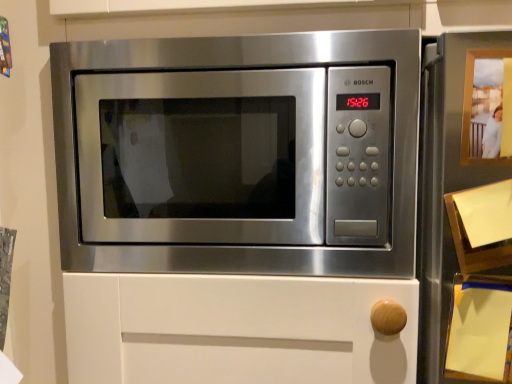
Question: Should I look upward or downward to see matte wood photo frame at upper right?

Choices:
 (A) up
 (B) down

Answer: (A)

Question: Considering the relative sizes of matte wood photo frame at upper right and stainless steel microwave at center in the image provided, is matte wood photo frame at upper right taller than stainless steel microwave at center?

Choices:
 (A) no
 (B) yes

Answer: (A)

Question: From a real-world perspective, is matte wood photo frame at upper right below stainless steel microwave at center?

Choices:
 (A) yes
 (B) no

Answer: (B)

Question: Is matte wood photo frame at upper right far from stainless steel microwave at center?

Choices:
 (A) no
 (B) yes

Answer: (A)

Question: Considering the relative sizes of matte wood photo frame at upper right and stainless steel microwave at center in the image provided, is matte wood photo frame at upper right smaller than stainless steel microwave at center?

Choices:
 (A) yes
 (B) no

Answer: (A)

Question: Is matte wood photo frame at upper right turned away from stainless steel microwave at center?

Choices:
 (A) yes
 (B) no

Answer: (B)

Question: Considering the relative positions of matte wood photo frame at upper right and stainless steel microwave at center in the image provided, is matte wood photo frame at upper right behind stainless steel microwave at center?

Choices:
 (A) yes
 (B) no

Answer: (B)

Question: From a real-world perspective, is stainless steel microwave at center physically below matte wood photo frame at upper right?

Choices:
 (A) no
 (B) yes

Answer: (B)

Question: Considering the relative sizes of stainless steel microwave at center and matte wood photo frame at upper right in the image provided, is stainless steel microwave at center smaller than matte wood photo frame at upper right?

Choices:
 (A) no
 (B) yes

Answer: (A)

Question: From the image's perspective, is stainless steel microwave at center under matte wood photo frame at upper right?

Choices:
 (A) no
 (B) yes

Answer: (B)

Question: Could you tell me if stainless steel microwave at center is facing matte wood photo frame at upper right?

Choices:
 (A) yes
 (B) no

Answer: (B)

Question: Considering the relative positions of stainless steel microwave at center and matte wood photo frame at upper right in the image provided, is stainless steel microwave at center to the left of matte wood photo frame at upper right from the viewer's perspective?

Choices:
 (A) no
 (B) yes

Answer: (B)

Question: From a real-world perspective, is stainless steel microwave at center over matte wood photo frame at upper right?

Choices:
 (A) yes
 (B) no

Answer: (B)

Question: Visually, is matte wood photo frame at upper right positioned to the left or to the right of stainless steel microwave at center?

Choices:
 (A) right
 (B) left

Answer: (A)